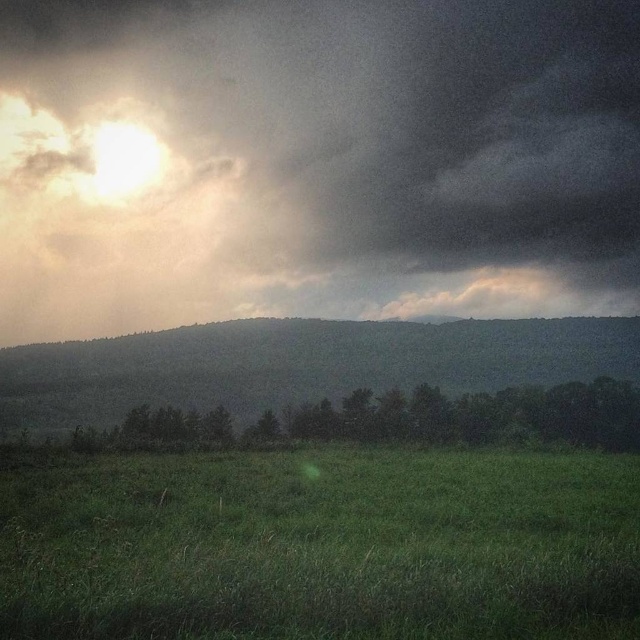
This screenshot has width=640, height=640. In order to click on green grassy field at lower center in this screenshot , I will do `click(321, 547)`.

Does green grassy field at lower center appear over green grassy hillside at center?

No.

The height and width of the screenshot is (640, 640). What do you see at coordinates (321, 547) in the screenshot? I see `green grassy field at lower center` at bounding box center [321, 547].

Find the location of a particular element. This screenshot has height=640, width=640. green grassy field at lower center is located at coordinates (321, 547).

Can you confirm if dark cloudy sky at upper center is positioned to the left of green grassy hillside at center?

Incorrect, dark cloudy sky at upper center is not on the left side of green grassy hillside at center.

Does dark cloudy sky at upper center have a larger size compared to green grassy hillside at center?

Correct, dark cloudy sky at upper center is larger in size than green grassy hillside at center.

The image size is (640, 640). What do you see at coordinates (314, 161) in the screenshot?
I see `dark cloudy sky at upper center` at bounding box center [314, 161].

This screenshot has height=640, width=640. What are the coordinates of `dark cloudy sky at upper center` in the screenshot? It's located at (314, 161).

Does dark cloudy sky at upper center have a smaller size compared to green leafy trees at center?

No.

What are the coordinates of `dark cloudy sky at upper center` in the screenshot? It's located at (314, 161).

Where is `dark cloudy sky at upper center`? Image resolution: width=640 pixels, height=640 pixels. dark cloudy sky at upper center is located at coordinates (314, 161).